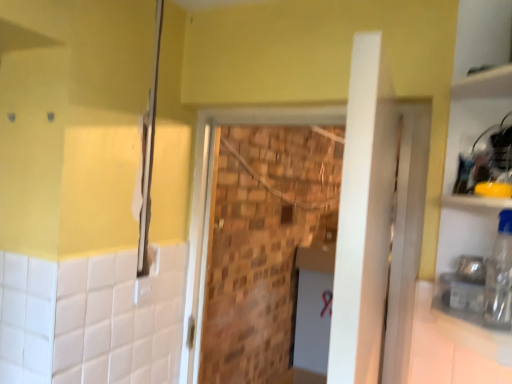
Question: Is white glossy counter top at lower right facing away from brick wall at center?

Choices:
 (A) no
 (B) yes

Answer: (A)

Question: Can you confirm if white glossy counter top at lower right is wider than brick wall at center?

Choices:
 (A) no
 (B) yes

Answer: (B)

Question: Can you confirm if white glossy counter top at lower right is taller than brick wall at center?

Choices:
 (A) no
 (B) yes

Answer: (A)

Question: Is white glossy counter top at lower right bigger than brick wall at center?

Choices:
 (A) yes
 (B) no

Answer: (B)

Question: Is white glossy counter top at lower right not close to brick wall at center?

Choices:
 (A) yes
 (B) no

Answer: (B)

Question: From a real-world perspective, is white glossy counter top at lower right located beneath brick wall at center?

Choices:
 (A) no
 (B) yes

Answer: (A)

Question: From a real-world perspective, is transparent plastic bottle at right on top of white glossy counter top at lower right?

Choices:
 (A) yes
 (B) no

Answer: (A)

Question: Considering the relative positions of transparent plastic bottle at right and white glossy counter top at lower right in the image provided, is transparent plastic bottle at right to the left of white glossy counter top at lower right from the viewer's perspective?

Choices:
 (A) yes
 (B) no

Answer: (A)

Question: Is transparent plastic bottle at right to the right of white glossy counter top at lower right from the viewer's perspective?

Choices:
 (A) yes
 (B) no

Answer: (B)

Question: Considering the relative sizes of transparent plastic bottle at right and white glossy counter top at lower right in the image provided, is transparent plastic bottle at right bigger than white glossy counter top at lower right?

Choices:
 (A) no
 (B) yes

Answer: (A)

Question: Is transparent plastic bottle at right positioned in front of white glossy counter top at lower right?

Choices:
 (A) yes
 (B) no

Answer: (B)

Question: Is transparent plastic bottle at right oriented away from white glossy counter top at lower right?

Choices:
 (A) yes
 (B) no

Answer: (A)

Question: Considering the relative sizes of brick wall at center and matte silver shower at left in the image provided, is brick wall at center shorter than matte silver shower at left?

Choices:
 (A) no
 (B) yes

Answer: (A)